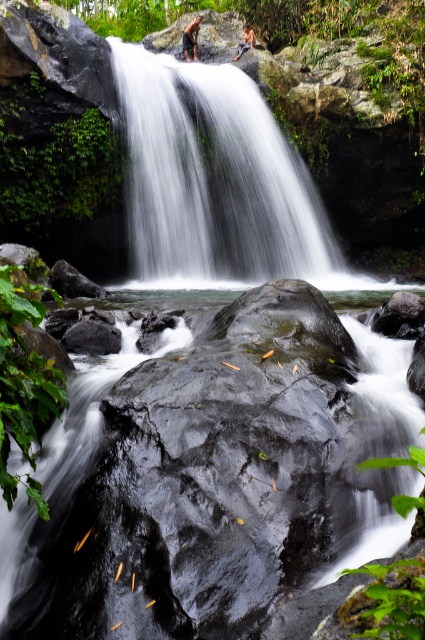
Question: Among these objects, which one is nearest to the camera?

Choices:
 (A) white smooth waterfall at center
 (B) brown furry bear at upper center

Answer: (A)

Question: Is glossy rock at center smaller than smooth skin person at upper center?

Choices:
 (A) yes
 (B) no

Answer: (B)

Question: Which point is closer to the camera?

Choices:
 (A) brown furry bear at upper center
 (B) white smooth waterfall at center
 (C) smooth skin person at upper center

Answer: (B)

Question: Does glossy rock at center have a smaller size compared to brown furry bear at upper center?

Choices:
 (A) no
 (B) yes

Answer: (A)

Question: Among these points, which one is nearest to the camera?

Choices:
 (A) (249, 29)
 (B) (285, 220)

Answer: (B)

Question: Does glossy rock at center have a smaller size compared to white smooth waterfall at center?

Choices:
 (A) yes
 (B) no

Answer: (A)